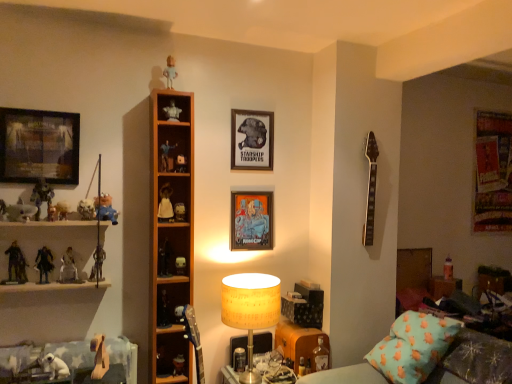
Question: In which direction should I rotate to look at matte black figurine at center, the ninth toy viewed from the right?

Choices:
 (A) right
 (B) left

Answer: (B)

Question: Would you say matte white figurine at left, which appears as the 3th toy when viewed from the left, contains metallic silver figure at left, positioned as the 2th toy in left-to-right order?

Choices:
 (A) no
 (B) yes

Answer: (A)

Question: Is matte white figurine at left, which appears as the 3th toy when viewed from the left, smaller than metallic silver figure at left, positioned as the 2th toy in left-to-right order?

Choices:
 (A) no
 (B) yes

Answer: (A)

Question: Considering the relative sizes of matte white figurine at left, which appears as the 3th toy when viewed from the left, and metallic silver figure at left, which is counted as the 18th toy, starting from the right, in the image provided, is matte white figurine at left, which appears as the 3th toy when viewed from the left, shorter than metallic silver figure at left, which is counted as the 18th toy, starting from the right,?

Choices:
 (A) yes
 (B) no

Answer: (A)

Question: Is matte white figurine at left, the 17th toy from the right, further to the viewer compared to metallic silver figure at left, positioned as the 2th toy in left-to-right order?

Choices:
 (A) no
 (B) yes

Answer: (A)

Question: Does matte white figurine at left, which appears as the 3th toy when viewed from the left, come in front of metallic silver figure at left, positioned as the 2th toy in left-to-right order?

Choices:
 (A) no
 (B) yes

Answer: (B)

Question: Can you confirm if matte white figurine at left, the 17th toy from the right, is positioned to the left of metallic silver figure at left, positioned as the 2th toy in left-to-right order?

Choices:
 (A) no
 (B) yes

Answer: (A)

Question: Is metallic silver figure at left, which is counted as the 18th toy, starting from the right, taller than teal fabric pillow at lower right?

Choices:
 (A) no
 (B) yes

Answer: (A)

Question: From a real-world perspective, does metallic silver figure at left, positioned as the 2th toy in left-to-right order, stand above teal fabric pillow at lower right?

Choices:
 (A) no
 (B) yes

Answer: (B)

Question: Is metallic silver figure at left, positioned as the 2th toy in left-to-right order, located outside teal fabric pillow at lower right?

Choices:
 (A) no
 (B) yes

Answer: (B)

Question: Is metallic silver figure at left, positioned as the 2th toy in left-to-right order, at the left side of teal fabric pillow at lower right?

Choices:
 (A) no
 (B) yes

Answer: (B)

Question: Considering the relative sizes of metallic silver figure at left, which is counted as the 18th toy, starting from the right, and teal fabric pillow at lower right in the image provided, is metallic silver figure at left, which is counted as the 18th toy, starting from the right, wider than teal fabric pillow at lower right?

Choices:
 (A) no
 (B) yes

Answer: (A)

Question: Is metallic silver figure at left, positioned as the 2th toy in left-to-right order, aimed at teal fabric pillow at lower right?

Choices:
 (A) no
 (B) yes

Answer: (A)

Question: Is white matte figurine at upper center, which is counted as the 14th toy, starting from the left, next to matte paper picture frame at center, the 2th picture frame when ordered from back to front, and touching it?

Choices:
 (A) yes
 (B) no

Answer: (B)